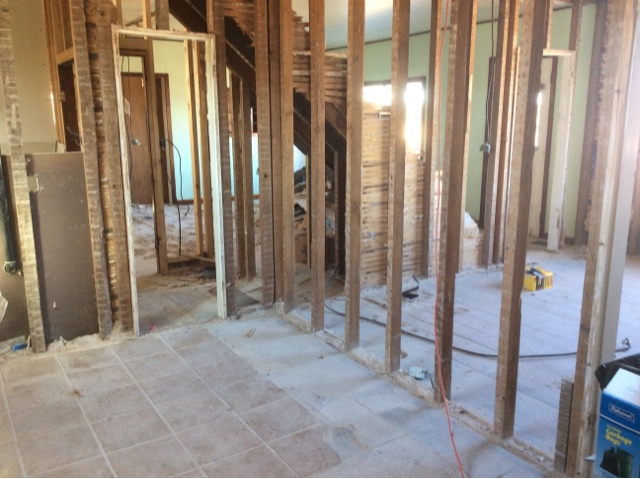
This screenshot has width=640, height=479. In order to click on door in this screenshot , I will do `click(136, 99)`.